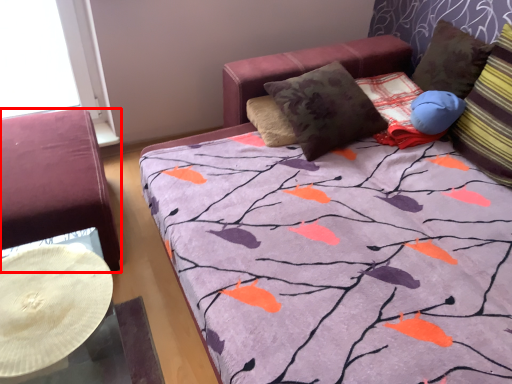
Question: From the image's perspective, what is the correct spatial relationship of furniture (annotated by the red box) in relation to pillow?

Choices:
 (A) above
 (B) below

Answer: (B)